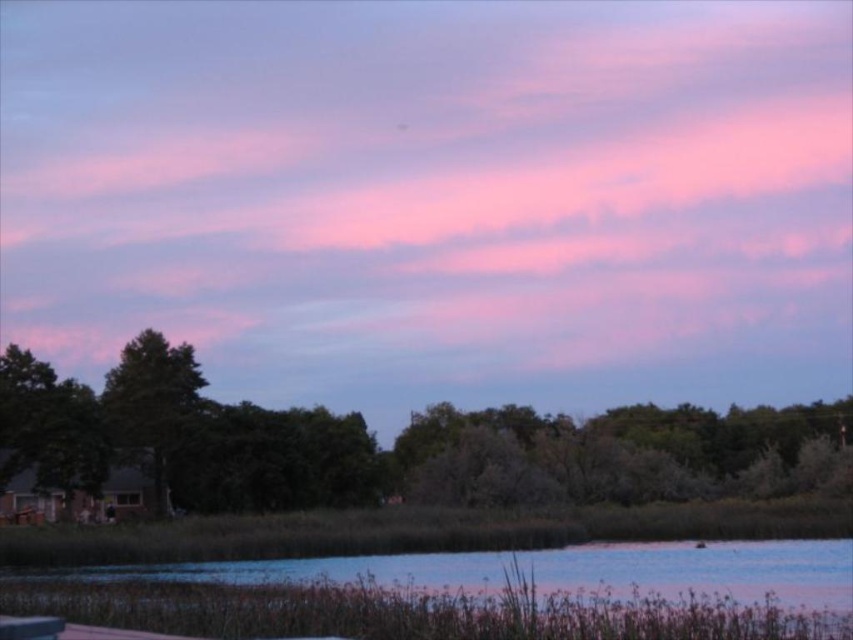
You are standing in the landscape and see the green leafy tree at lower left and the green leafy tree at left. Which tree is closer to the right edge of the scene?

The green leafy tree at lower left is positioned on the right side of green leafy tree at left, so it is closer to the right edge of the scene.

You are standing in the landscape scene and want to walk from the point at coordinates point (502, 552) to the point at coordinates point (129, 346). Which direction should you face to move towards the second point?

You should face downward because point (502, 552) is closer to the camera than point (129, 346), so the second point is further away and located downward from your current position.

You are standing on a wooden dock that is 2 meters wide and want to walk to the edge to get a better view of the blue water at lower center. Can you safely walk to the edge without falling into the water?

The blue water at lower center is 21.68 meters away from the viewer. Since the dock is only 2 meters wide, you can safely walk to the edge as the distance to the water is much greater than the dock width, indicating the dock extends far enough.